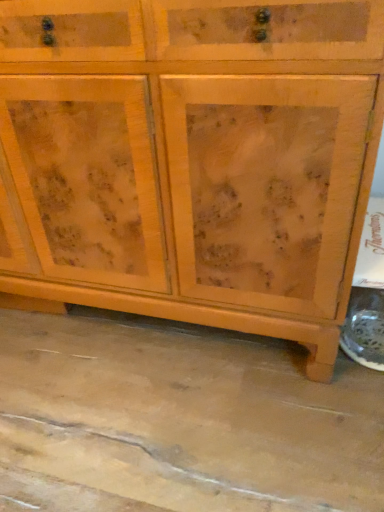
Describe the element at coordinates (195, 157) in the screenshot. I see `natural wood cabinet at center` at that location.

In order to face natural wood cabinet at center, should I rotate leftwards or rightwards?

You should look left and rotate roughly 7.909 degrees.

Locate an element on the screen. This screenshot has height=512, width=384. natural wood cabinet at center is located at coordinates (195, 157).

At what (x,y) coordinates should I click in order to perform the action: click on natural wood cabinet at center. Please return your answer as a coordinate pair (x, y). Image resolution: width=384 pixels, height=512 pixels. Looking at the image, I should click on (195, 157).